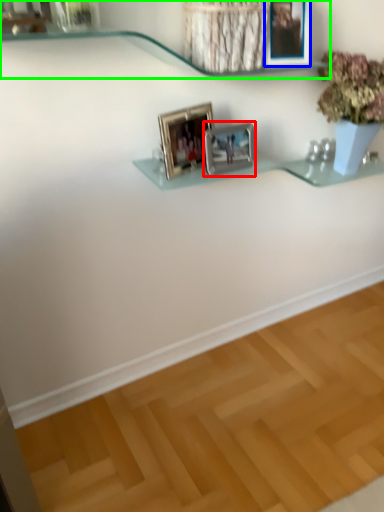
Question: Which is nearer to the picture frame (highlighted by a red box)? picture frame (highlighted by a blue box) or shelf (highlighted by a green box).

Choices:
 (A) picture frame
 (B) shelf

Answer: (A)